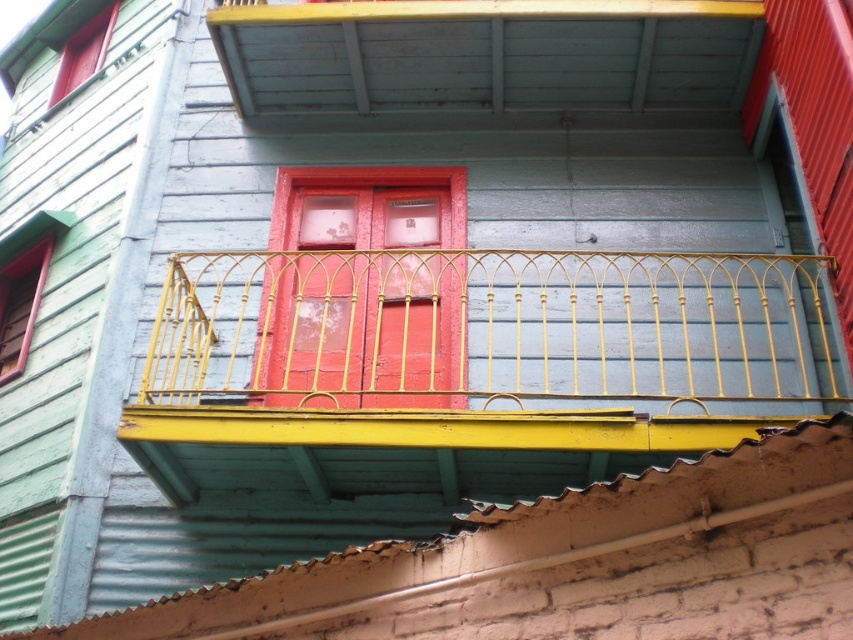
You are a GUI agent. You are given a task and a screenshot of the screen. Output one action in this format:
    pyautogui.click(x=<x>, y=<y>)
    Task: Click on the matte red window at left
    This screenshot has width=853, height=640.
    Given the screenshot: What is the action you would take?
    pyautogui.click(x=20, y=307)

Between matte red window at left and matte red window at upper left, which one has more height?

Standing taller between the two is matte red window at left.

At what (x,y) coordinates should I click in order to perform the action: click on matte red window at left. Please return your answer as a coordinate pair (x, y). Looking at the image, I should click on (20, 307).

Looking at this image, who is shorter, gold wrought iron balcony at center or smooth red door at center?

gold wrought iron balcony at center is shorter.

Between gold wrought iron balcony at center and smooth red door at center, which one is positioned lower?

gold wrought iron balcony at center

Where is `gold wrought iron balcony at center`? gold wrought iron balcony at center is located at coordinates (476, 356).

Image resolution: width=853 pixels, height=640 pixels. Identify the location of gold wrought iron balcony at center. (476, 356).

Does gold wrought iron balcony at center appear on the right side of matte red window at upper left?

Indeed, gold wrought iron balcony at center is positioned on the right side of matte red window at upper left.

Who is lower down, gold wrought iron balcony at center or matte red window at upper left?

Positioned lower is gold wrought iron balcony at center.

Between point (467, 442) and point (83, 58), which one is positioned behind?

The point (83, 58) is behind.

I want to click on gold wrought iron balcony at center, so click(476, 356).